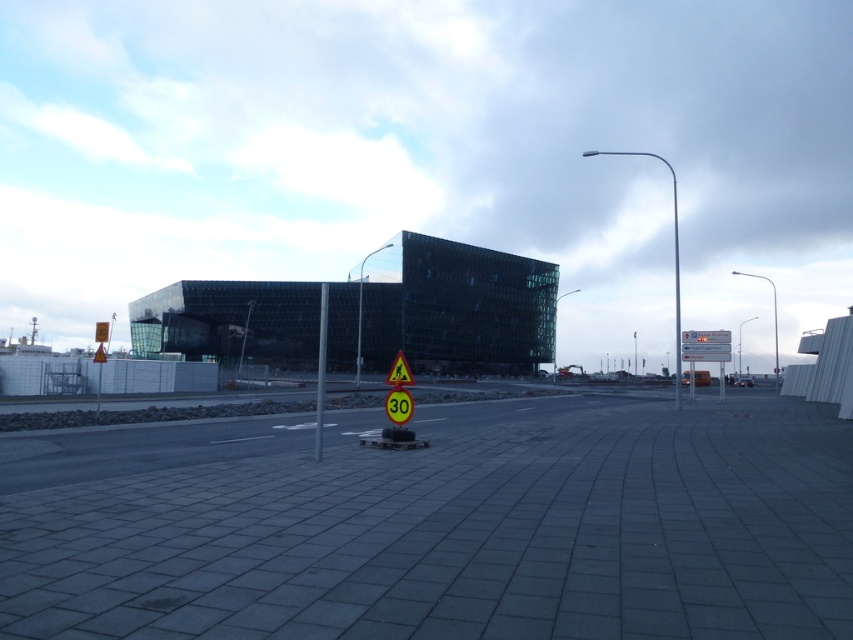
You are a pedestrian standing at the intersection and need to cross the road. You see the gray concrete pavement at center and the metallic pole at center. Which object is located to the right of the other?

The gray concrete pavement at center is positioned on the right side of metallic pole at center.

You are standing at the pedestrian crossing indicated by the yellow triangular sign with the walking person and the number 30. You notice two points marked in the scene. One is at coordinates point (703,417) and the other at point (402,420). Which point is closer to you as you face the building?

Point (402,420) is closer to you because it is in front of point (703,417), which is further back.

You are standing at point (x=322, y=385) and want to walk to point (x=682, y=579). According to the scene description, which direction should you move relative to the modern architectural structure in the background?

You should move towards the modern architectural structure in the background because point (x=682, y=579) is in front of point (x=322, y=385), meaning it is closer to the structure.